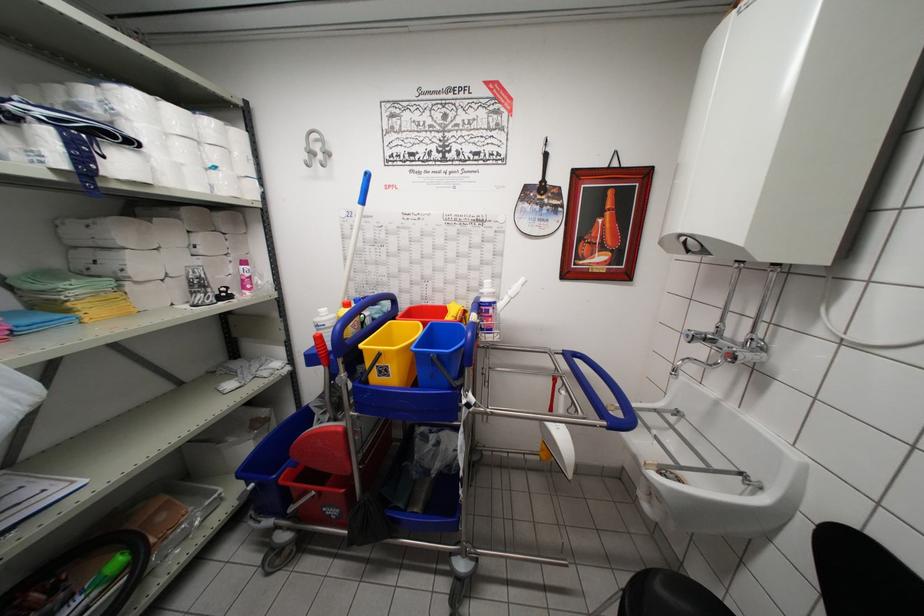
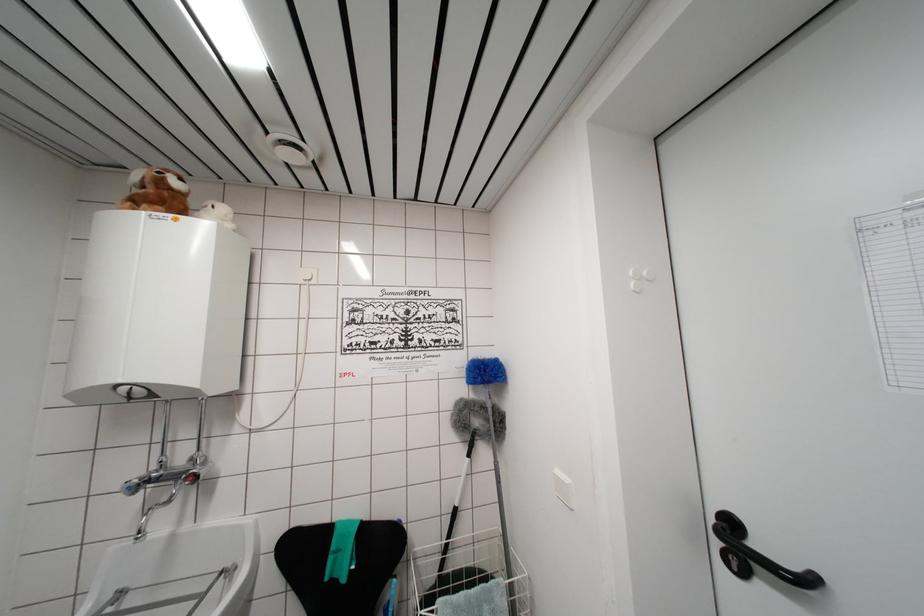
Find the pixel in the second image that matches point (719, 471) in the first image.

(209, 593)